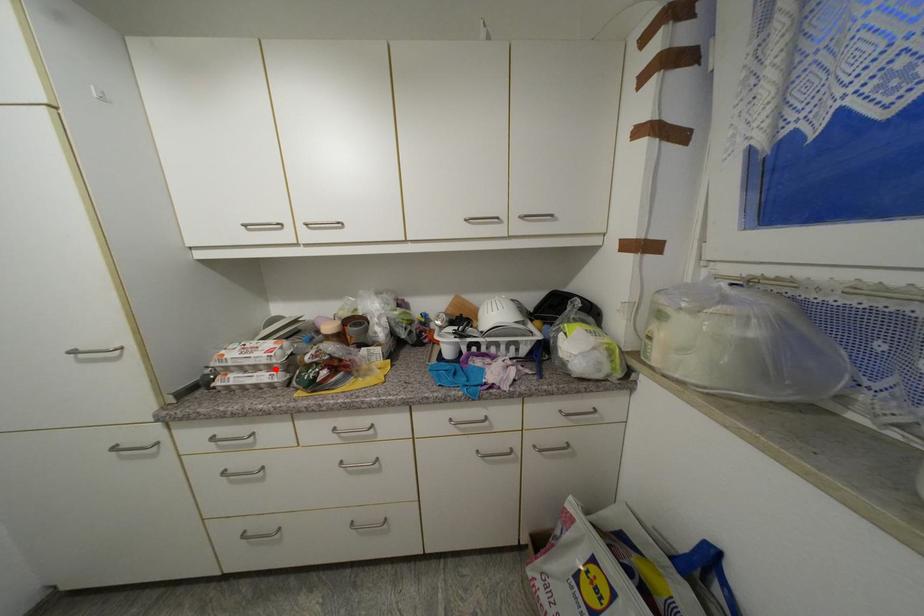
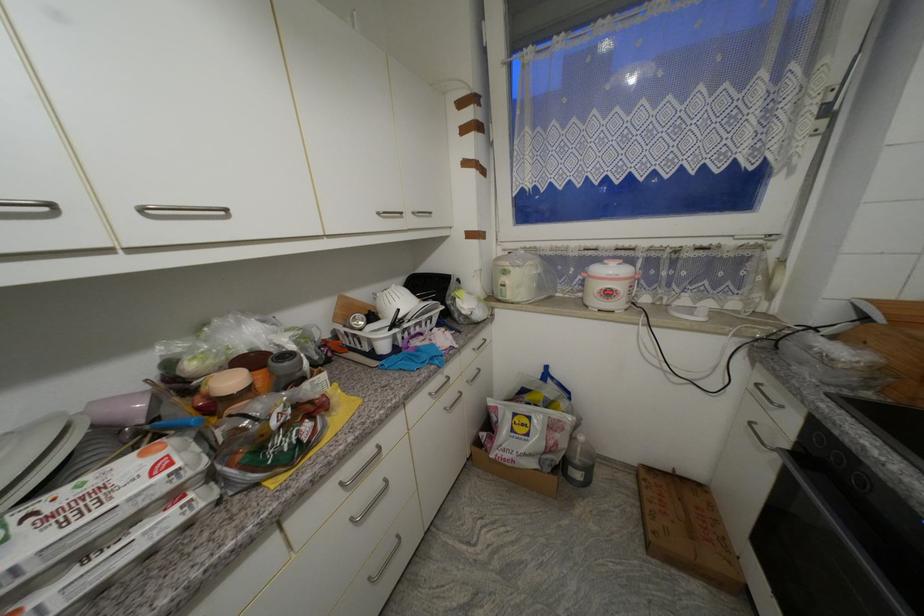
Find the pixel in the second image that matches the highlighted location in the first image.

(178, 498)